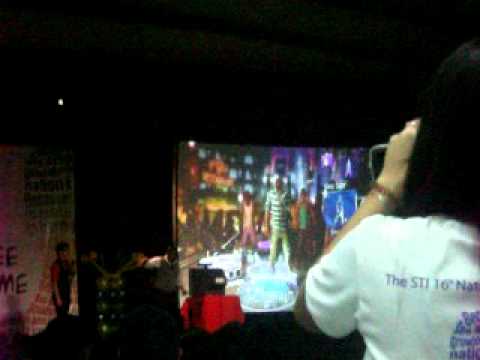
The height and width of the screenshot is (360, 480). Find the location of `tv screen`. tv screen is located at coordinates (283, 205).